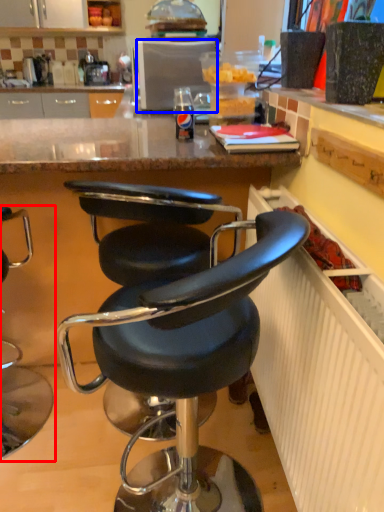
Question: Which object appears closest to the camera in this image, chair (highlighted by a red box) or appliance (highlighted by a blue box)?

Choices:
 (A) chair
 (B) appliance

Answer: (A)